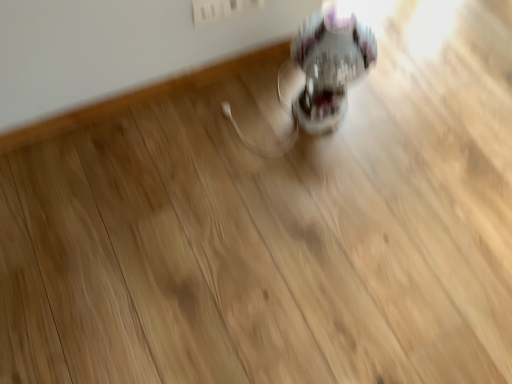
The width and height of the screenshot is (512, 384). What are the coordinates of `free space that is to the left of translucent plastic swivel chair at center` in the screenshot? It's located at (259, 105).